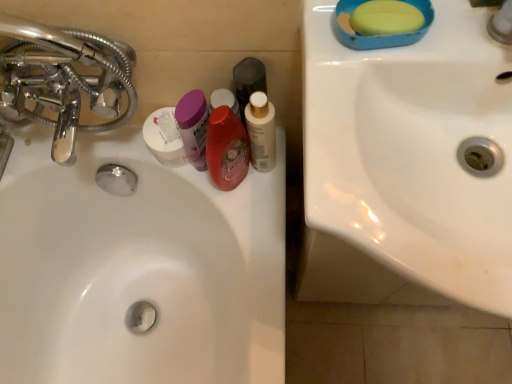
Find the location of a particular element. free location to the right of yellow matte soap at upper right is located at coordinates (463, 32).